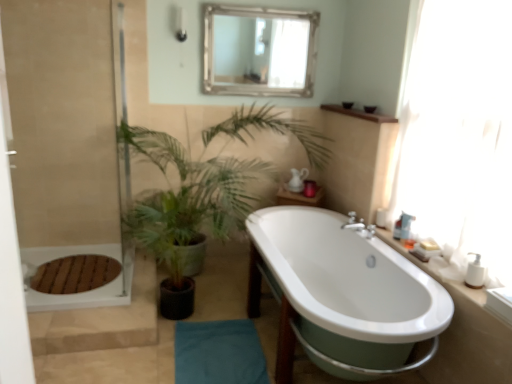
Question: Is white glossy bathtub at center closer to the viewer compared to green leafy plant at center?

Choices:
 (A) yes
 (B) no

Answer: (A)

Question: Does white glossy bathtub at center have a larger size compared to green leafy plant at center?

Choices:
 (A) no
 (B) yes

Answer: (A)

Question: Does white glossy bathtub at center appear on the right side of green leafy plant at center?

Choices:
 (A) yes
 (B) no

Answer: (A)

Question: Is white glossy bathtub at center completely or partially outside of green leafy plant at center?

Choices:
 (A) no
 (B) yes

Answer: (A)

Question: Is white glossy bathtub at center positioned with its back to green leafy plant at center?

Choices:
 (A) yes
 (B) no

Answer: (B)

Question: From the image's perspective, is white glossy bathtub at center beneath green leafy plant at center?

Choices:
 (A) yes
 (B) no

Answer: (A)

Question: From a real-world perspective, is white ceramic sink at right, the second counter top positioned from the top, beneath matte white shower at upper left?

Choices:
 (A) no
 (B) yes

Answer: (B)

Question: Is white ceramic sink at right, which is the second counter top from back to front, turned away from matte white shower at upper left?

Choices:
 (A) yes
 (B) no

Answer: (B)

Question: From the image's perspective, is white ceramic sink at right, the second counter top positioned from the top, located beneath matte white shower at upper left?

Choices:
 (A) yes
 (B) no

Answer: (A)

Question: Does white ceramic sink at right, which is the first counter top in bottom-to-top order, appear on the left side of matte white shower at upper left?

Choices:
 (A) yes
 (B) no

Answer: (B)

Question: Is matte white shower at upper left completely or partially inside white ceramic sink at right, which is the second counter top from back to front?

Choices:
 (A) no
 (B) yes

Answer: (A)

Question: Is white plastic soap dispenser at right, the 3th toiletry from the front, positioned with its back to wooden shelf at upper center, the first counter top positioned from the top?

Choices:
 (A) no
 (B) yes

Answer: (A)